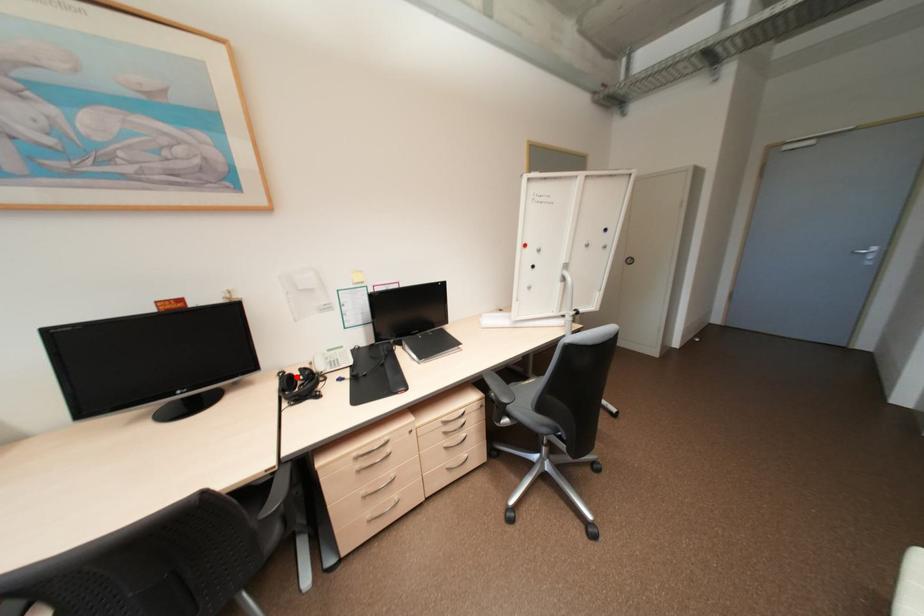
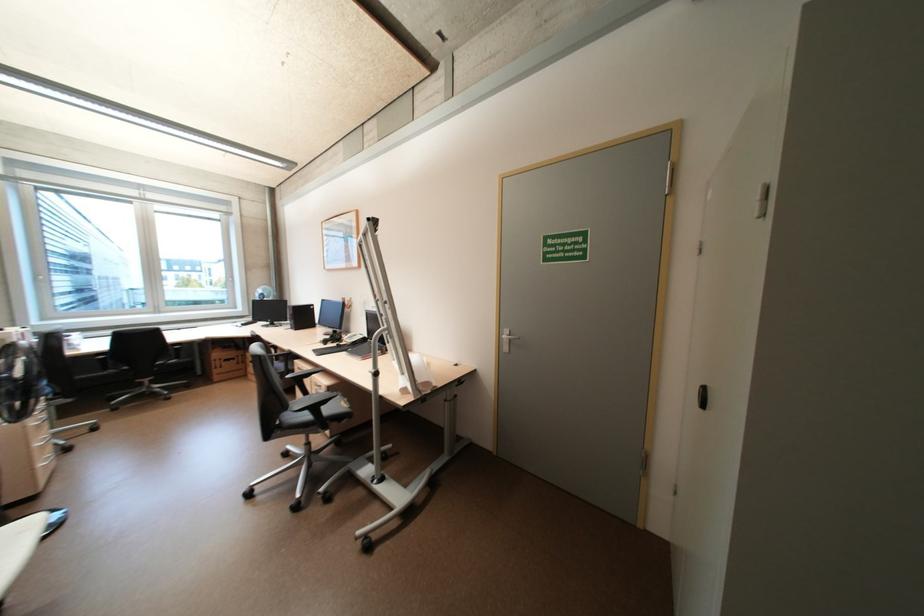
Question: I am providing you with two images of the same scene from different viewpoints. A red point is marked on the first image. Is the red point's position out of view in image 2?

Choices:
 (A) Yes
 (B) No

Answer: (A)